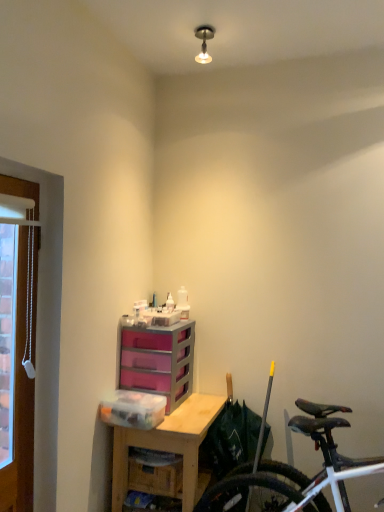
Question: Is pink plastic chest of drawers at center thinner than brown wooden door at left?

Choices:
 (A) no
 (B) yes

Answer: (A)

Question: From the image's perspective, is pink plastic chest of drawers at center under brown wooden door at left?

Choices:
 (A) no
 (B) yes

Answer: (B)

Question: Is pink plastic chest of drawers at center aimed at brown wooden door at left?

Choices:
 (A) yes
 (B) no

Answer: (A)

Question: Is pink plastic chest of drawers at center not near brown wooden door at left?

Choices:
 (A) no
 (B) yes

Answer: (A)

Question: Is pink plastic chest of drawers at center placed right next to brown wooden door at left?

Choices:
 (A) yes
 (B) no

Answer: (B)

Question: Considering the relative positions of pink plastic chest of drawers at center and brown wooden door at left in the image provided, is pink plastic chest of drawers at center in front of brown wooden door at left?

Choices:
 (A) yes
 (B) no

Answer: (B)

Question: Can you confirm if wooden desk at center is taller than pink plastic chest of drawers at center?

Choices:
 (A) no
 (B) yes

Answer: (B)

Question: From a real-world perspective, is wooden desk at center located higher than pink plastic chest of drawers at center?

Choices:
 (A) yes
 (B) no

Answer: (B)

Question: Can you confirm if wooden desk at center is wider than pink plastic chest of drawers at center?

Choices:
 (A) yes
 (B) no

Answer: (A)

Question: Does wooden desk at center come in front of pink plastic chest of drawers at center?

Choices:
 (A) yes
 (B) no

Answer: (A)

Question: Can you confirm if wooden desk at center is bigger than pink plastic chest of drawers at center?

Choices:
 (A) no
 (B) yes

Answer: (B)

Question: Is wooden desk at center turned away from pink plastic chest of drawers at center?

Choices:
 (A) no
 (B) yes

Answer: (A)

Question: Considering the relative sizes of clear plastic container at lower center and wooden desk at center in the image provided, is clear plastic container at lower center thinner than wooden desk at center?

Choices:
 (A) no
 (B) yes

Answer: (B)